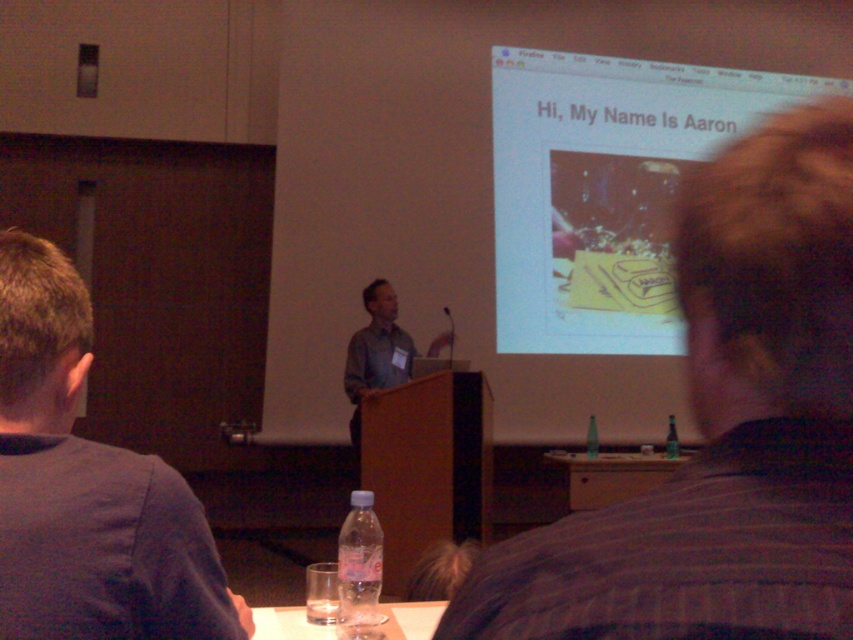
Is gray shirt at center smaller than green glass bottle at right?

No.

Can you confirm if gray shirt at center is taller than green glass bottle at right?

Yes, gray shirt at center is taller than green glass bottle at right.

Who is more forward, [369,340] or [672,419]?

Point [369,340]

This screenshot has width=853, height=640. I want to click on gray shirt at center, so click(375, 353).

Who is more distant from viewer, (x=604, y=227) or (x=596, y=449)?

The point (x=604, y=227) is behind.

Identify the location of white glossy projector screen at upper center. The width and height of the screenshot is (853, 640). (604, 188).

Which is in front, point (537, 336) or point (666, 438)?

Positioned in front is point (666, 438).

Can you confirm if white glossy projector screen at upper center is shorter than green glass bottle at right?

Incorrect, white glossy projector screen at upper center's height does not fall short of green glass bottle at right's.

Where is `white glossy projector screen at upper center`? white glossy projector screen at upper center is located at coordinates (604, 188).